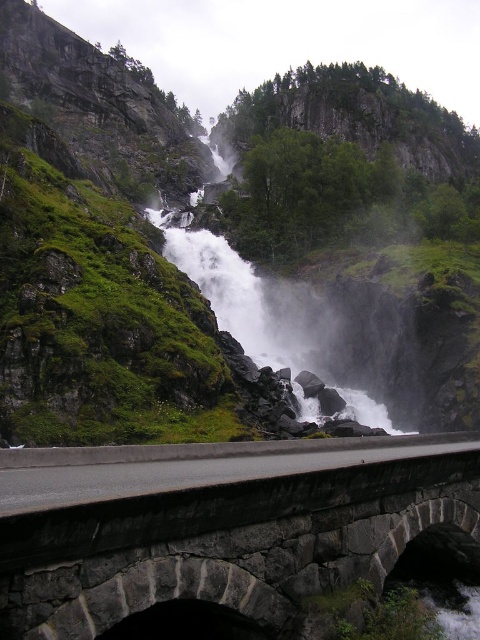
Can you confirm if dark gray stone bridge at center is smaller than white mist at center?

Indeed, dark gray stone bridge at center has a smaller size compared to white mist at center.

This screenshot has width=480, height=640. Describe the element at coordinates (216, 524) in the screenshot. I see `dark gray stone bridge at center` at that location.

Find the location of a particular element. The height and width of the screenshot is (640, 480). dark gray stone bridge at center is located at coordinates (216, 524).

What do you see at coordinates (216, 524) in the screenshot? I see `dark gray stone bridge at center` at bounding box center [216, 524].

Does point (439, 506) come behind point (295, 467)?

No.

Locate an element on the screen. dark gray stone bridge at center is located at coordinates (216, 524).

Is gray asphalt highway at lower center closer to the viewer compared to white mist at center?

Yes, it is in front of white mist at center.

Between gray asphalt highway at lower center and white mist at center, which one is positioned higher?

white mist at center is above.

Identify the location of gray asphalt highway at lower center. The width and height of the screenshot is (480, 640). (190, 465).

The height and width of the screenshot is (640, 480). I want to click on gray asphalt highway at lower center, so click(190, 465).